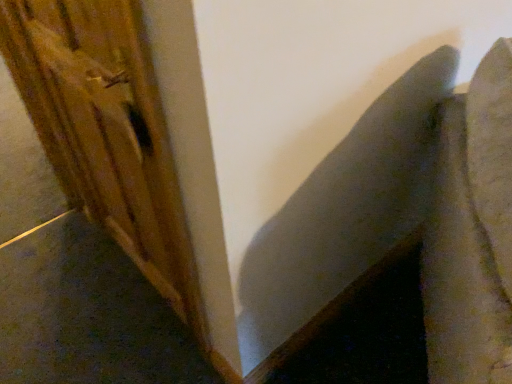
Question: From a real-world perspective, relative to wooden plank at left, is textured gray cushion at upper right vertically above or below?

Choices:
 (A) above
 (B) below

Answer: (B)

Question: In the image, is textured gray cushion at upper right on the left side or the right side of wooden plank at left?

Choices:
 (A) right
 (B) left

Answer: (A)

Question: Is point (483, 150) positioned closer to the camera than point (45, 4)?

Choices:
 (A) closer
 (B) farther

Answer: (A)

Question: Is point (162, 135) positioned closer to the camera than point (478, 105)?

Choices:
 (A) farther
 (B) closer

Answer: (B)

Question: Considering the positions of wooden plank at left and textured gray cushion at upper right in the image, is wooden plank at left taller or shorter than textured gray cushion at upper right?

Choices:
 (A) short
 (B) tall

Answer: (B)

Question: Is wooden plank at left inside the boundaries of textured gray cushion at upper right, or outside?

Choices:
 (A) outside
 (B) inside

Answer: (A)

Question: Would you say wooden plank at left is to the left or to the right of textured gray cushion at upper right in the picture?

Choices:
 (A) right
 (B) left

Answer: (B)